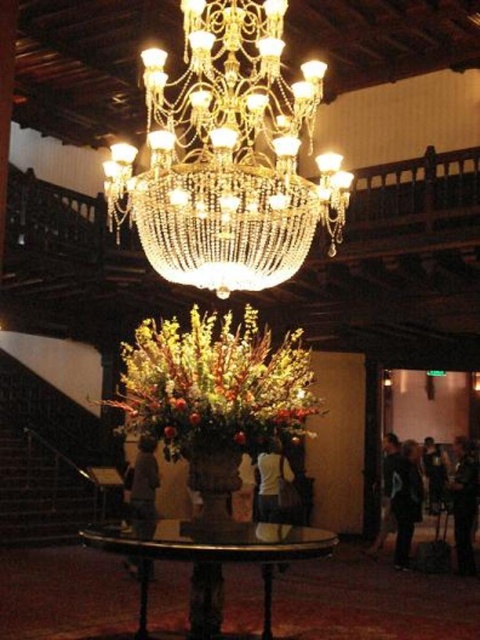
You are an interior designer planning to place a new rectangular sofa that is 2 meters wide in the grand hall. The sofa must be positioned near the dark blue fabric at lower right. Considering the space constraints, will the gold crystal chandelier at center interfere with placing the sofa there?

The gold crystal chandelier at center has a width larger than the dark blue fabric at lower right. Since the sofa is 2 meters wide and needs to be placed near the dark blue fabric at lower right, the chandelier might not directly interfere with the sofa placement as the fabric area is narrower, but the chandelier itself is wider. However, the exact positioning would depend on the available space around the fabric area. Without specific distance details, it is recommended to ensure there is enough clearance.

You are a guest standing in the lobby and see the shiny metallic vase at center and the dark blue fabric at lower right. Which one is closer to the ceiling?

The shiny metallic vase at center is closer to the ceiling because it is located above the dark blue fabric at lower right.